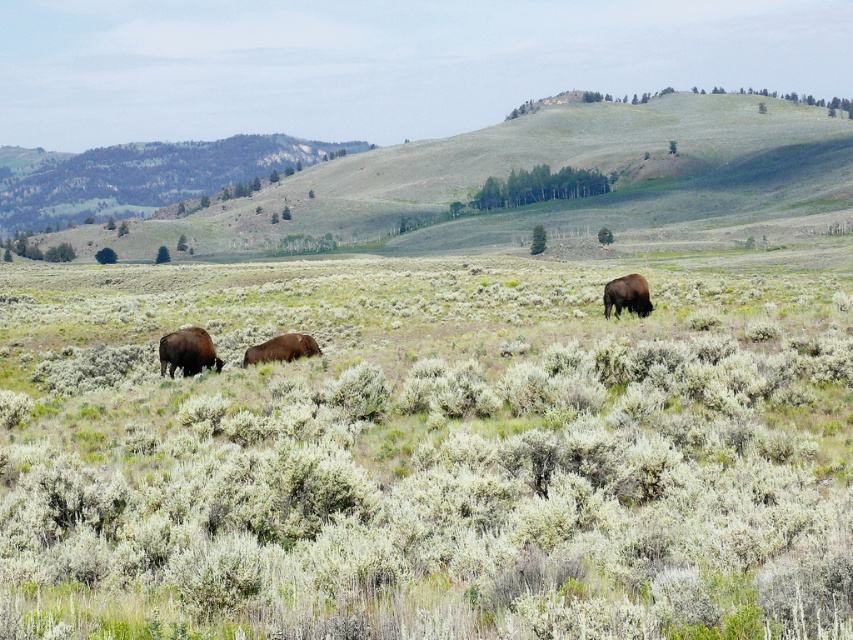
Question: Considering the real-world distances, which object is closest to the brown fur bison at right?

Choices:
 (A) brown furry bison at center
 (B) brown furry bison at left

Answer: (A)

Question: From the image, what is the correct spatial relationship of brown fur bison at right in relation to brown furry bison at center?

Choices:
 (A) above
 (B) below

Answer: (A)

Question: Is green grassy hillside at center positioned behind brown furry bison at center?

Choices:
 (A) no
 (B) yes

Answer: (B)

Question: Does green grassy hillside at center lie in front of brown furry bison at center?

Choices:
 (A) no
 (B) yes

Answer: (A)

Question: Based on their relative distances, which object is nearer to the brown fur bison at right?

Choices:
 (A) brown furry bison at center
 (B) green grassy hillside at center

Answer: (A)

Question: Considering the real-world distances, which object is closest to the brown furry bison at left?

Choices:
 (A) brown fur bison at right
 (B) brown furry bison at center
 (C) green grassy hillside at center

Answer: (B)